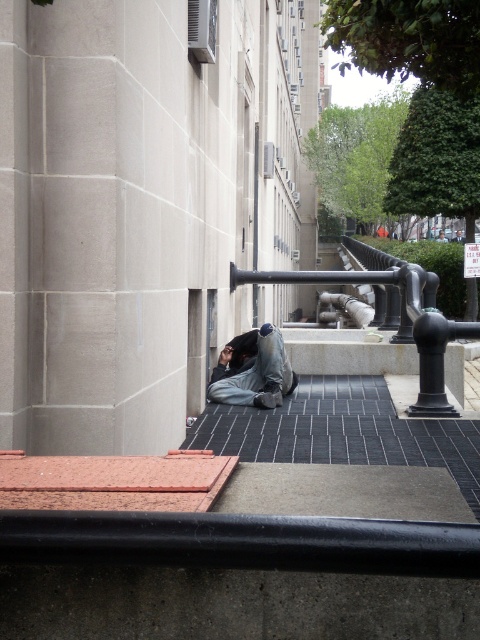
Is black metal rail at center wider than denim pants at lower center?

Correct, the width of black metal rail at center exceeds that of denim pants at lower center.

Locate an element on the screen. The image size is (480, 640). black metal rail at center is located at coordinates (398, 324).

What are the coordinates of `black metal rail at center` in the screenshot? It's located at (398, 324).